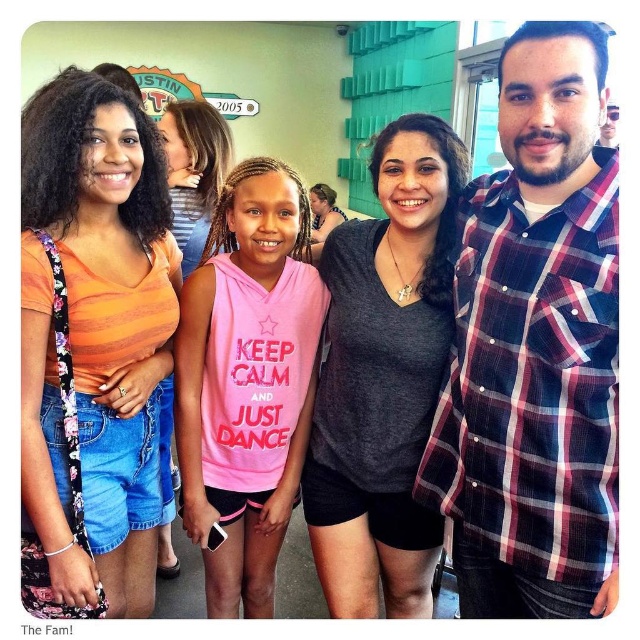
Question: Estimate the real-world distances between objects in this image. Which object is closer to the pink cotton hoodie at center?

Choices:
 (A) dark gray matte shirt at center
 (B) plaid shirt at right

Answer: (A)

Question: Which point is farther from the camera taking this photo?

Choices:
 (A) (408, 442)
 (B) (205, 592)
 (C) (173, 140)

Answer: (C)

Question: Which point is closer to the camera?

Choices:
 (A) plaid shirt at right
 (B) pink sleeveless hoodie at center

Answer: (A)

Question: From the image, what is the correct spatial relationship of orange cotton tank top at left in relation to dark gray matte shirt at center?

Choices:
 (A) left
 (B) right

Answer: (A)

Question: Is plaid shirt at right above pink sleeveless hoodie at center?

Choices:
 (A) no
 (B) yes

Answer: (B)

Question: Considering the relative positions of pink sleeveless hoodie at center and pink cotton hoodie at center in the image provided, where is pink sleeveless hoodie at center located with respect to pink cotton hoodie at center?

Choices:
 (A) above
 (B) below

Answer: (B)